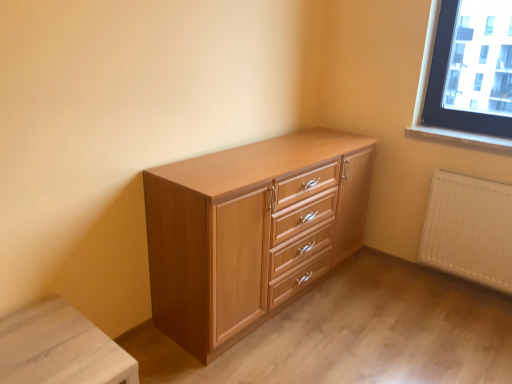
Question: In terms of width, does light brown wood chest of drawers at center look wider or thinner when compared to smooth wood window sill at upper right?

Choices:
 (A) thin
 (B) wide

Answer: (B)

Question: Is light brown wood chest of drawers at center situated inside smooth wood window sill at upper right or outside?

Choices:
 (A) outside
 (B) inside

Answer: (A)

Question: Which object is the farthest from the smooth wood window sill at upper right?

Choices:
 (A) white matte radiator at lower right
 (B) light brown wood chest of drawers at center
 (C) light wood changing table at lower left

Answer: (C)

Question: Which object is the farthest from the light brown wood chest of drawers at center?

Choices:
 (A) white matte radiator at lower right
 (B) smooth wood window sill at upper right
 (C) light wood changing table at lower left

Answer: (B)